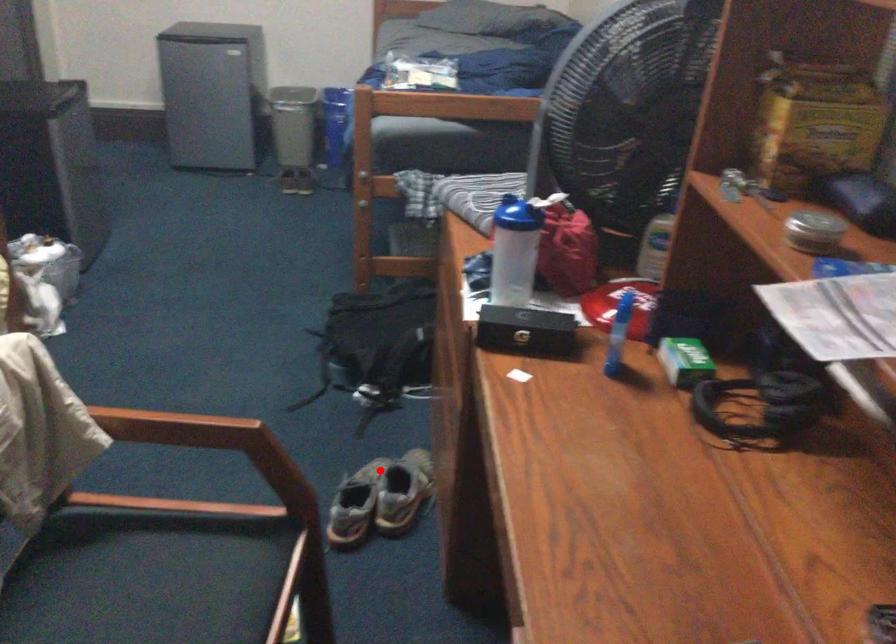
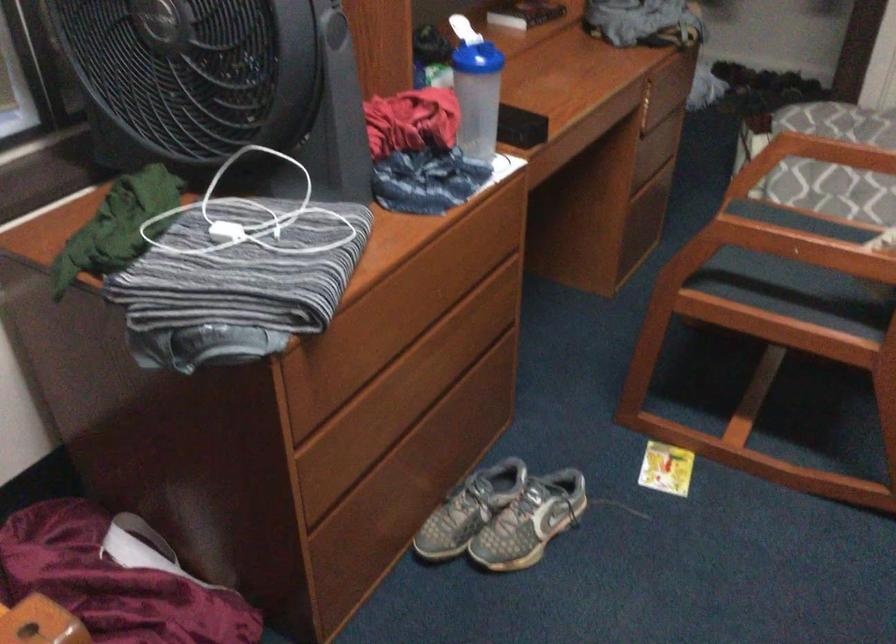
Question: I am providing you with two images of the same scene from different viewpoints. Image1 has a red point marked. In image2, the corresponding 3D location appears at what relative position? Reply with the corresponding letter.

Choices:
 (A) Closer
 (B) Farther

Answer: (A)